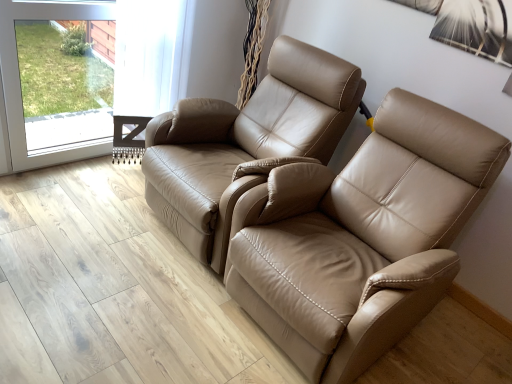
Question: Does transparent glass screen door at upper left have a lesser height compared to tan leather chair at center, arranged as the second chair when viewed from the right?

Choices:
 (A) no
 (B) yes

Answer: (B)

Question: From the image's perspective, is transparent glass screen door at upper left on top of tan leather chair at center, arranged as the second chair when viewed from the right?

Choices:
 (A) yes
 (B) no

Answer: (A)

Question: Is transparent glass screen door at upper left at the right side of tan leather chair at center, the first chair from the left?

Choices:
 (A) no
 (B) yes

Answer: (A)

Question: Is transparent glass screen door at upper left closer to the viewer compared to tan leather chair at center, the first chair from the left?

Choices:
 (A) yes
 (B) no

Answer: (B)

Question: Is transparent glass screen door at upper left located outside tan leather chair at center, arranged as the second chair when viewed from the right?

Choices:
 (A) no
 (B) yes

Answer: (B)

Question: Is transparent glass screen door at upper left oriented towards tan leather chair at center, arranged as the second chair when viewed from the right?

Choices:
 (A) no
 (B) yes

Answer: (B)

Question: Considering the relative positions of tan leather chair at center, the first chair from the left, and tan leather recliner at center, which appears as the first chair when viewed from the right, in the image provided, is tan leather chair at center, the first chair from the left, to the right of tan leather recliner at center, which appears as the first chair when viewed from the right, from the viewer's perspective?

Choices:
 (A) yes
 (B) no

Answer: (B)

Question: Considering the relative sizes of tan leather chair at center, arranged as the second chair when viewed from the right, and tan leather recliner at center, the second chair in the left-to-right sequence, in the image provided, is tan leather chair at center, arranged as the second chair when viewed from the right, thinner than tan leather recliner at center, the second chair in the left-to-right sequence,?

Choices:
 (A) no
 (B) yes

Answer: (B)

Question: Would you say tan leather chair at center, arranged as the second chair when viewed from the right, contains tan leather recliner at center, the second chair in the left-to-right sequence?

Choices:
 (A) yes
 (B) no

Answer: (B)

Question: Does tan leather chair at center, the first chair from the left, appear on the left side of tan leather recliner at center, which appears as the first chair when viewed from the right?

Choices:
 (A) yes
 (B) no

Answer: (A)

Question: Does tan leather chair at center, arranged as the second chair when viewed from the right, have a larger size compared to tan leather recliner at center, the second chair in the left-to-right sequence?

Choices:
 (A) yes
 (B) no

Answer: (B)

Question: Does tan leather chair at center, the first chair from the left, come behind tan leather recliner at center, the second chair in the left-to-right sequence?

Choices:
 (A) yes
 (B) no

Answer: (A)

Question: Considering the relative sizes of transparent glass screen door at upper left and tan leather recliner at center, which appears as the first chair when viewed from the right, in the image provided, is transparent glass screen door at upper left thinner than tan leather recliner at center, which appears as the first chair when viewed from the right,?

Choices:
 (A) yes
 (B) no

Answer: (A)